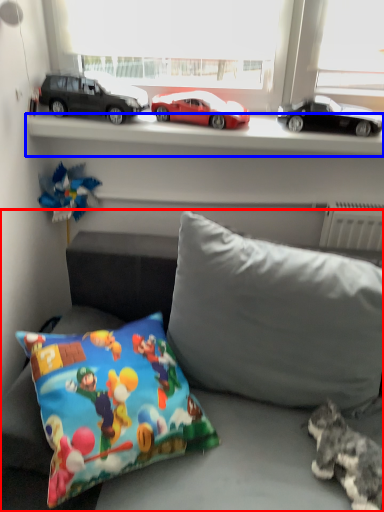
Question: Which object appears closest to the camera in this image, studio couch (highlighted by a red box) or window sill (highlighted by a blue box)?

Choices:
 (A) studio couch
 (B) window sill

Answer: (A)